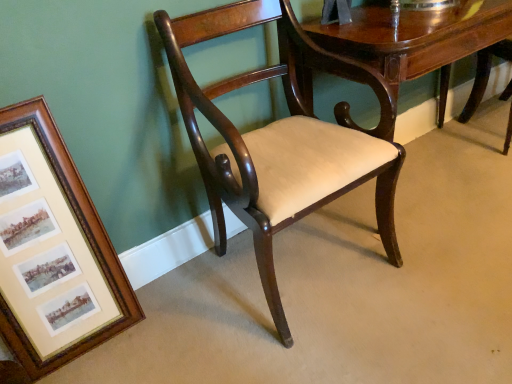
Image resolution: width=512 pixels, height=384 pixels. I want to click on free space on the front side of mahogany wood chair at center, so click(x=340, y=347).